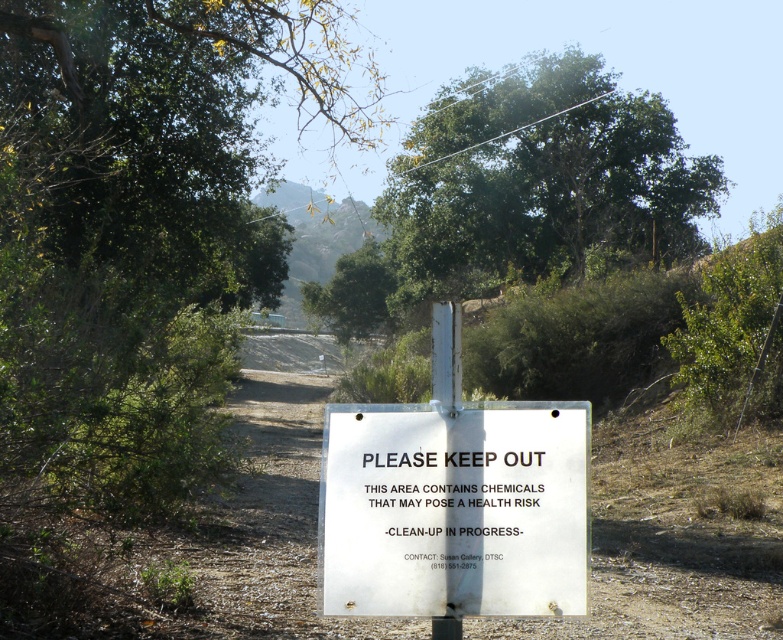
You are a hiker who has come across the green leafy tree at upper center and the white paper sign at center. Which object would block your view more if you were standing directly in front of them?

The green leafy tree at upper center would block your view more than the white paper sign at center because it is larger in size.

You are a drone operator tasked with aerial photography. Your camera is mounted on a drone that is currently at ground level. You need to capture a photo of the green leafy tree at upper center. The drone can only fly up to 100 feet high. Can the drone safely reach the tree to take the photo?

The green leafy tree at upper center is 96.43 feet from the camera. Since the drone can fly up to 100 feet, it can safely reach the tree to take the photo as 96.43 feet is within the drone height limit.